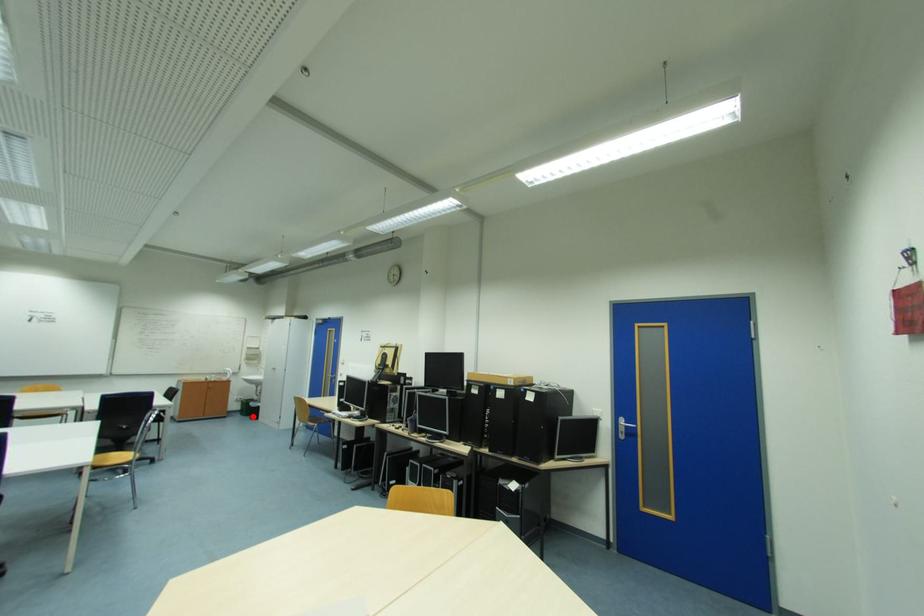
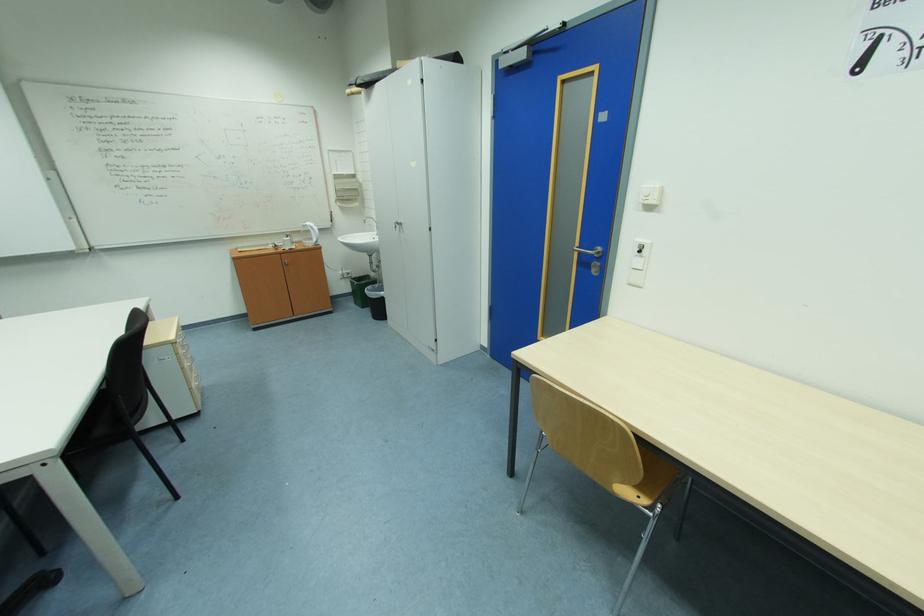
Locate, in the second image, the point that corresponds to the highlighted location in the first image.

(370, 309)